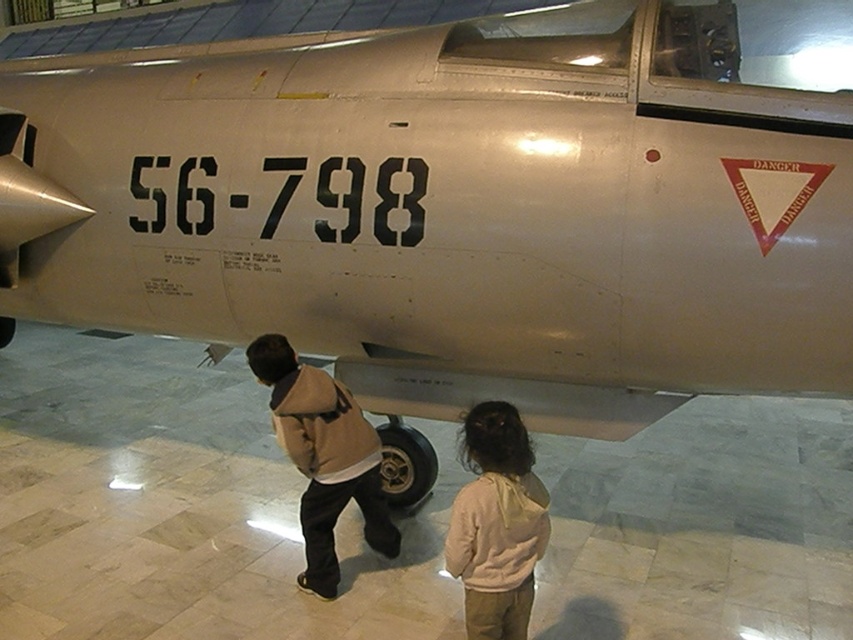
Between white fleece hoodie at lower center and tan suede jacket at lower center, which one appears on the right side from the viewer's perspective?

Positioned to the right is white fleece hoodie at lower center.

The height and width of the screenshot is (640, 853). Describe the element at coordinates (496, 524) in the screenshot. I see `white fleece hoodie at lower center` at that location.

Where is `white fleece hoodie at lower center`? The height and width of the screenshot is (640, 853). white fleece hoodie at lower center is located at coordinates (496, 524).

From the picture: Can you confirm if tan suede jacket at lower center is bigger than black rubber tire at center?

Yes.

Does tan suede jacket at lower center have a greater width compared to black rubber tire at center?

Yes, tan suede jacket at lower center is wider than black rubber tire at center.

Which is in front, point (282, 392) or point (421, 444)?

Point (282, 392)

Image resolution: width=853 pixels, height=640 pixels. I want to click on tan suede jacket at lower center, so click(323, 458).

Measure the distance between white fleece hoodie at lower center and black rubber tire at center.

They are 1.23 meters apart.

This screenshot has height=640, width=853. Find the location of `white fleece hoodie at lower center`. white fleece hoodie at lower center is located at coordinates tap(496, 524).

Is point (476, 440) farther from camera compared to point (416, 474)?

No, it is in front of (416, 474).

At what (x,y) coordinates should I click in order to perform the action: click on white fleece hoodie at lower center. Please return your answer as a coordinate pair (x, y). Looking at the image, I should click on (496, 524).